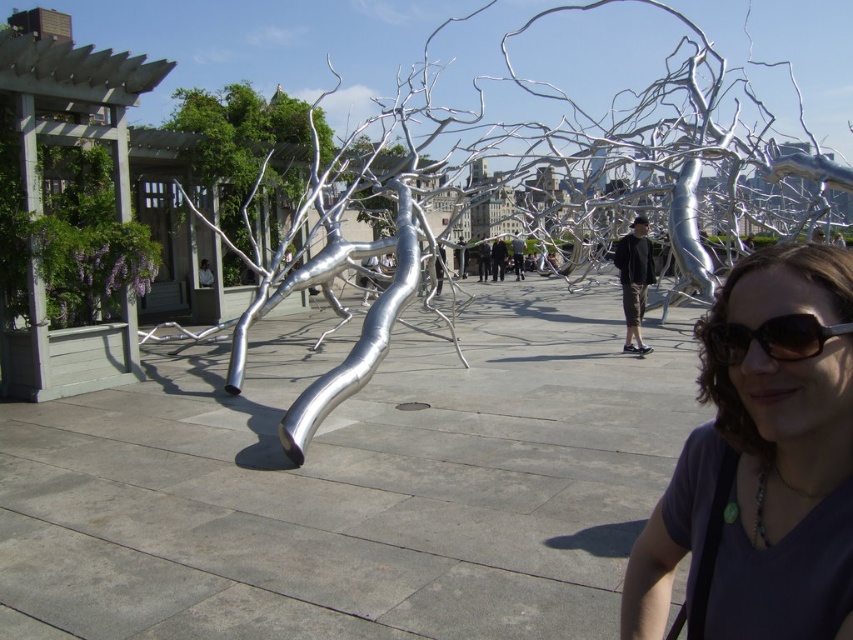
Is matte black shirt at lower right to the left of black reflective sunglasses at lower right from the viewer's perspective?

Incorrect, matte black shirt at lower right is not on the left side of black reflective sunglasses at lower right.

Is matte black shirt at lower right positioned at the back of black reflective sunglasses at lower right?

No, it is not.

Is point (639, 632) in front of point (827, 326)?

No.

At what (x,y) coordinates should I click in order to perform the action: click on matte black shirt at lower right. Please return your answer as a coordinate pair (x, y). This screenshot has height=640, width=853. Looking at the image, I should click on coord(761,464).

Does point (276, 156) lie behind point (709, 349)?

Yes.

Can you confirm if brushed metal tree at upper left is thinner than black reflective sunglasses at lower right?

No, brushed metal tree at upper left is not thinner than black reflective sunglasses at lower right.

What do you see at coordinates (244, 148) in the screenshot? The width and height of the screenshot is (853, 640). I see `brushed metal tree at upper left` at bounding box center [244, 148].

The image size is (853, 640). I want to click on brushed metal tree at upper left, so click(244, 148).

Which is behind, point (711, 508) or point (183, 106)?

The point (183, 106) is behind.

Who is more forward, (x=724, y=280) or (x=314, y=113)?

Positioned in front is point (x=724, y=280).

Identify the location of matte black shirt at lower right. (761, 464).